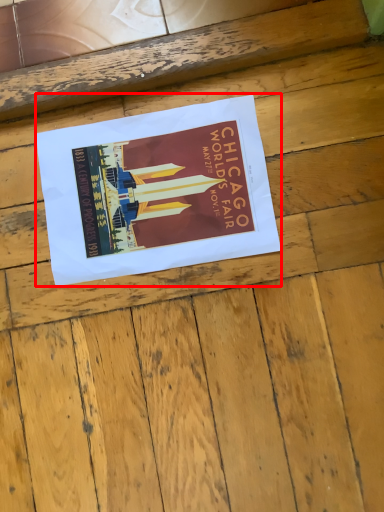
Question: From the image's perspective, what is the correct spatial positioning of poster (annotated by the red box) in reference to plywood?

Choices:
 (A) below
 (B) above

Answer: (B)